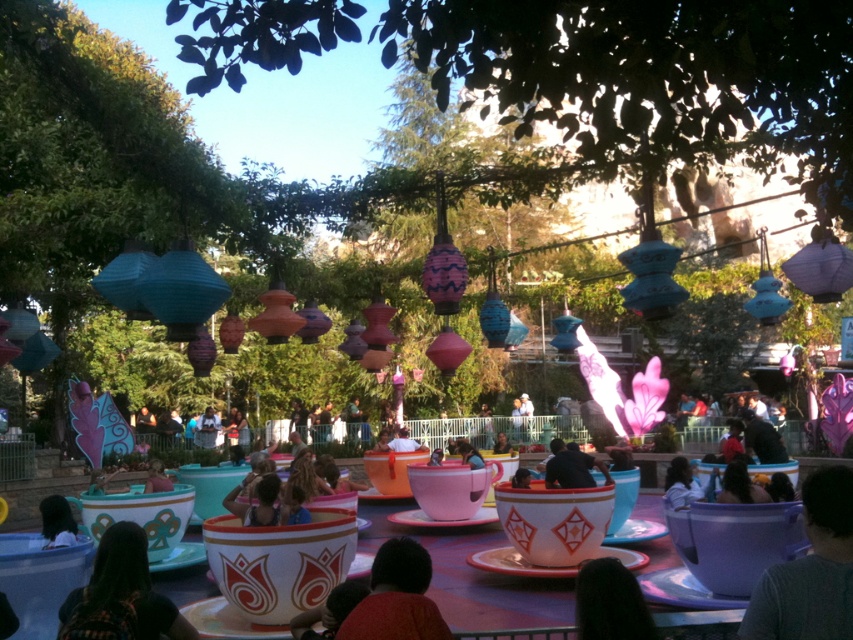
Question: Which point is farther to the camera?

Choices:
 (A) (103, 556)
 (B) (148, 484)
 (C) (56, 515)
 (D) (561, 465)

Answer: (B)

Question: Can you confirm if plaid shirt at lower left is positioned below matte black shirt at center?

Choices:
 (A) no
 (B) yes

Answer: (A)

Question: Is dark hair at lower left to the left of matte blue shirt at center from the viewer's perspective?

Choices:
 (A) yes
 (B) no

Answer: (A)

Question: Does dark gray shirt at lower right have a larger size compared to matte black shirt at center?

Choices:
 (A) no
 (B) yes

Answer: (A)

Question: Which point appears farthest from the camera in this image?

Choices:
 (A) (67, 541)
 (B) (653, 628)
 (C) (666, 486)

Answer: (C)

Question: Considering the real-world distances, which object is closest to the pink fabric person at center?

Choices:
 (A) plaid shirt at lower left
 (B) matte black shirt at center

Answer: (B)